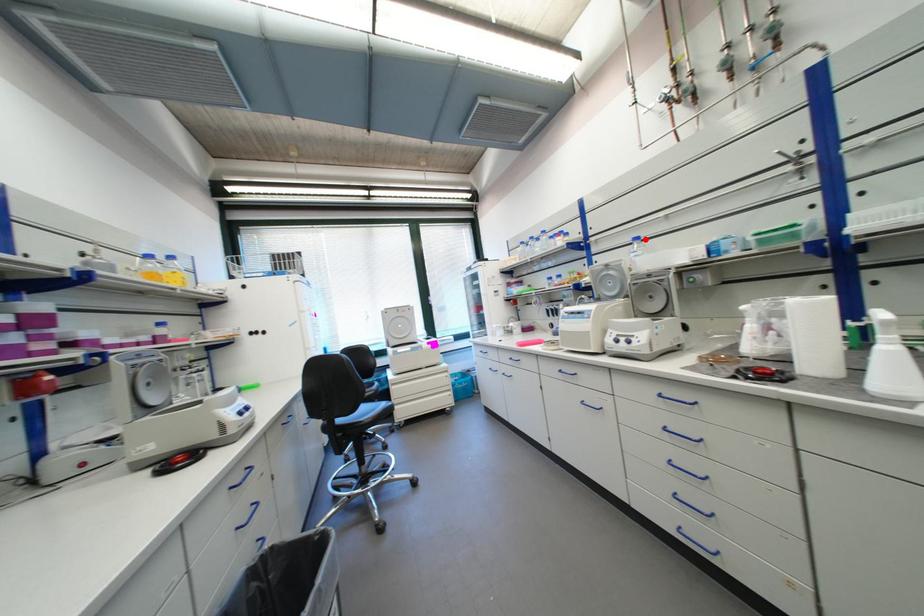
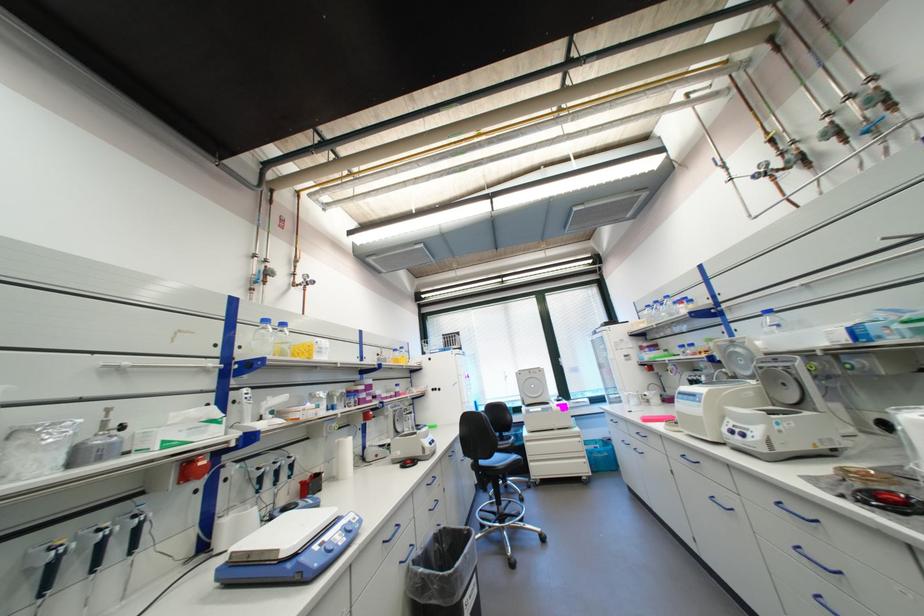
Find the pixel in the second image that matches the highlighted location in the first image.

(776, 312)